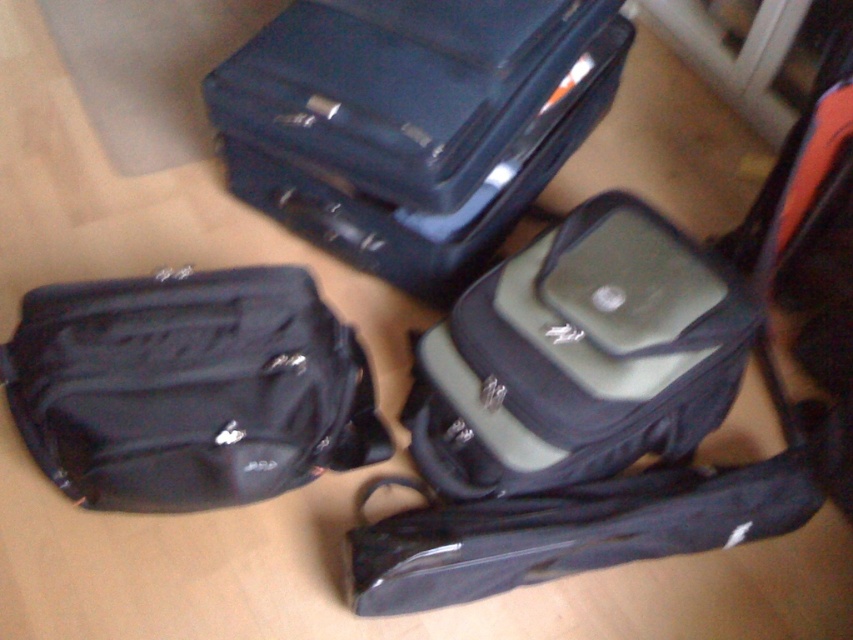
You are packing for a trip and need to place your black fabric bag at lower left and green fabric laptop case at center into a storage compartment that is 30 centimeters wide. Will both items fit side by side in the compartment?

The black fabric bag at lower left and green fabric laptop case at center are 30.97 centimeters apart, which is slightly wider than the 30 centimeter compartment. Therefore, they will not fit side by side in the compartment.

You are organizing a storage space and need to place the matte black suitcase at upper center and the green fabric laptop case at center. Given their widths, which one requires more horizontal space?

The matte black suitcase at upper center requires more horizontal space because its width surpasses that of the green fabric laptop case at center.

In the scene shown: You are packing for a trip and need to know which item is taller between the matte black suitcase at upper center and the green fabric laptop case at center. Based on the scene description, which one is taller?

The matte black suitcase at upper center is taller than the green fabric laptop case at center according to the description.